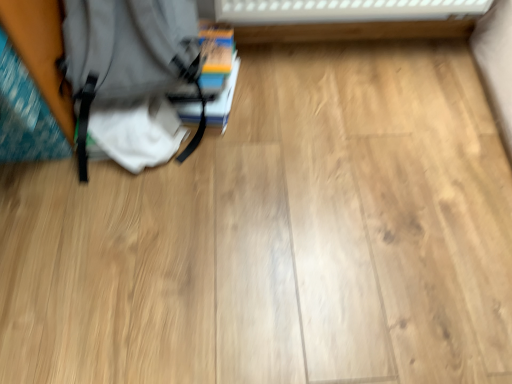
Question: Is hardcover book at center-left facing towards matte gray backpack at left?

Choices:
 (A) yes
 (B) no

Answer: (A)

Question: Is hardcover book at center-left thinner than matte gray backpack at left?

Choices:
 (A) yes
 (B) no

Answer: (B)

Question: From the image's perspective, does hardcover book at center-left appear higher than matte gray backpack at left?

Choices:
 (A) yes
 (B) no

Answer: (A)

Question: Is hardcover book at center-left outside matte gray backpack at left?

Choices:
 (A) no
 (B) yes

Answer: (B)

Question: Is hardcover book at center-left taller than matte gray backpack at left?

Choices:
 (A) yes
 (B) no

Answer: (B)

Question: Is hardcover book at center-left looking in the opposite direction of matte gray backpack at left?

Choices:
 (A) yes
 (B) no

Answer: (B)

Question: Does matte gray backpack at left have a greater width compared to hardcover book at center-left?

Choices:
 (A) no
 (B) yes

Answer: (A)

Question: Considering the relative sizes of matte gray backpack at left and hardcover book at center-left in the image provided, is matte gray backpack at left taller than hardcover book at center-left?

Choices:
 (A) yes
 (B) no

Answer: (A)

Question: Is matte gray backpack at left far from hardcover book at center-left?

Choices:
 (A) yes
 (B) no

Answer: (B)

Question: Is matte gray backpack at left bigger than hardcover book at center-left?

Choices:
 (A) yes
 (B) no

Answer: (A)

Question: Is matte gray backpack at left outside of hardcover book at center-left?

Choices:
 (A) yes
 (B) no

Answer: (A)

Question: Is matte gray backpack at left closer to the viewer compared to hardcover book at center-left?

Choices:
 (A) no
 (B) yes

Answer: (B)

Question: From the image's perspective, relative to hardcover book at center-left, is matte gray backpack at left above or below?

Choices:
 (A) below
 (B) above

Answer: (A)